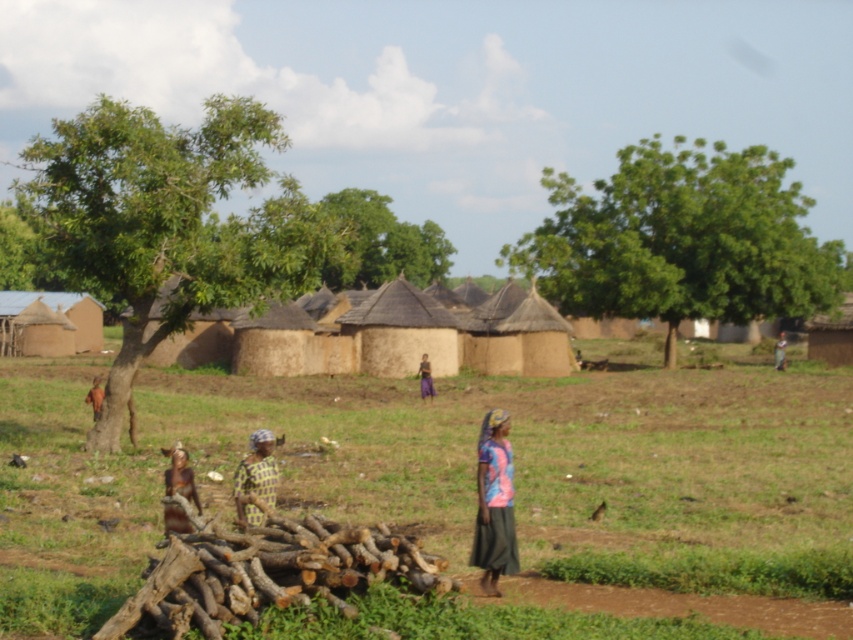
Question: Is brown dirt field at center smaller than printed fabric headscarf at center?

Choices:
 (A) yes
 (B) no

Answer: (B)

Question: Which point is farther to the camera?

Choices:
 (A) (502, 468)
 (B) (268, 556)

Answer: (A)

Question: Can you confirm if brown dirt field at center is positioned to the right of brown textured fabric at lower left?

Choices:
 (A) yes
 (B) no

Answer: (A)

Question: Does brown dirt field at center have a lesser width compared to multicolored fabric skirt at center?

Choices:
 (A) no
 (B) yes

Answer: (A)

Question: Which point appears farthest from the camera in this image?

Choices:
 (A) (773, 356)
 (B) (791, 424)

Answer: (A)

Question: Which object is closer to the camera taking this photo?

Choices:
 (A) light brown wooden stick at center
 (B) purple fabric at center
 (C) brown dirt field at center
 (D) printed fabric headscarf at center

Answer: (C)